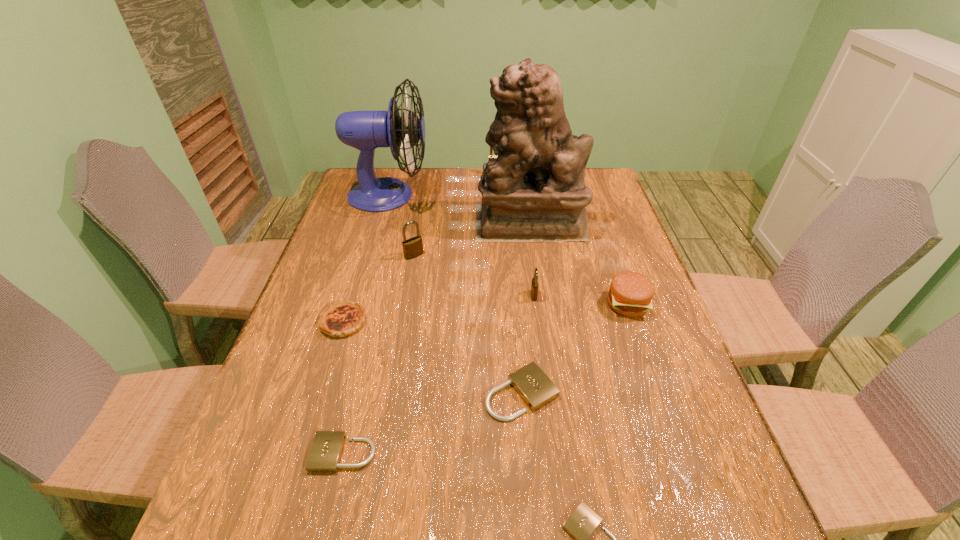
This screenshot has width=960, height=540. What are the coordinates of `vacant space positioned 0.220m on the right of the rightmost brass padlock` in the screenshot? It's located at [x=620, y=295].

At what (x,y) coordinates should I click in order to perform the action: click on free location located 0.170m on the left of the fifth shortest object. Please return your answer as a coordinate pair (x, y). Looking at the image, I should click on (541, 304).

At what (x,y) coordinates should I click in order to perform the action: click on vacant region located on the back of the quiche. Please return your answer as a coordinate pair (x, y). Looking at the image, I should click on (374, 220).

The width and height of the screenshot is (960, 540). Find the location of `vacant region located on the back of the farthest beige padlock`. vacant region located on the back of the farthest beige padlock is located at coordinates (515, 303).

The width and height of the screenshot is (960, 540). Identify the location of vacant space located on the front of the second nearest padlock. (324, 538).

I want to click on sculpture at the far edge, so pos(535,190).

This screenshot has width=960, height=540. Find the location of `fan that is at the far edge`. fan that is at the far edge is located at coordinates (364, 130).

The width and height of the screenshot is (960, 540). Find the location of `padlock that is at the far edge`. padlock that is at the far edge is located at coordinates (491, 155).

Identify the location of fan that is positioned at the left edge. coord(364,130).

Where is `quiche that is at the left edge`? quiche that is at the left edge is located at coordinates (339, 319).